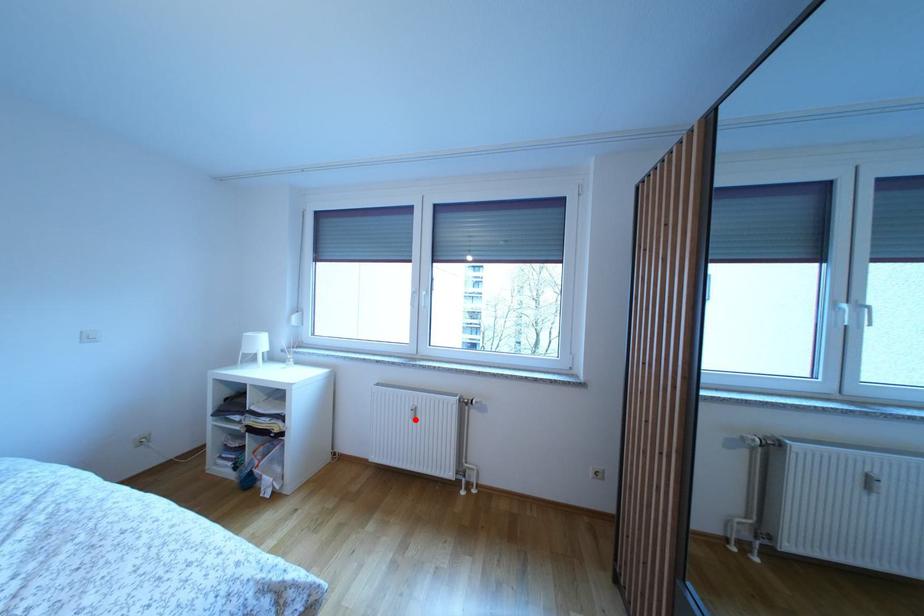
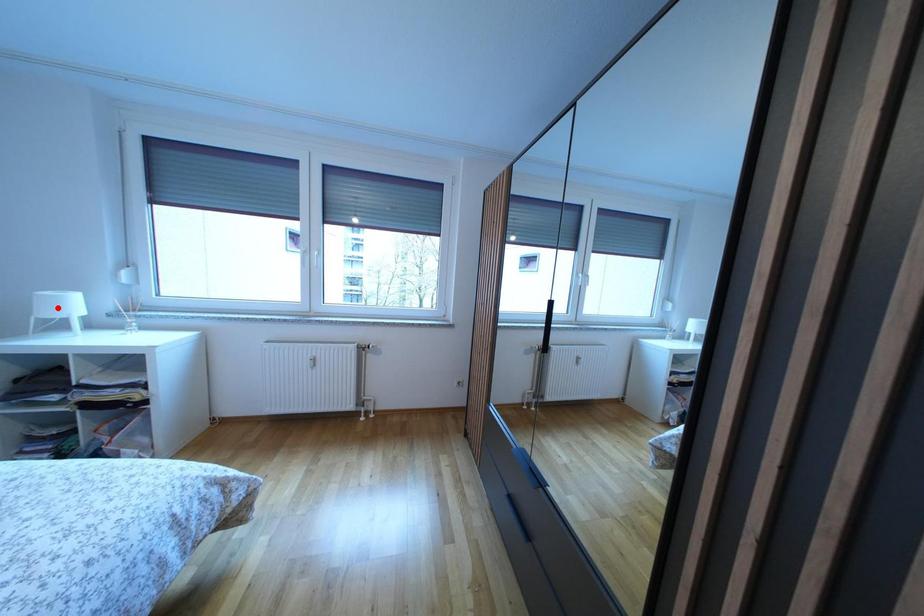
I am providing you with two images of the same scene from different viewpoints. A red point is marked on the first image and another point is marked on the second image. Are the points marked in image1 and image2 representing the same 3D position?

No